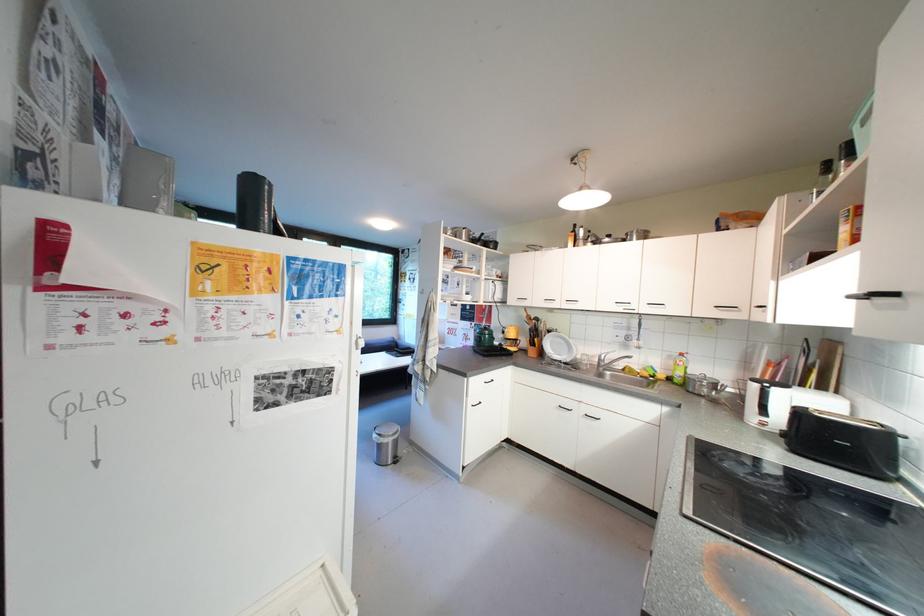
Where would you lift the white electric kettle? Please return your answer as a coordinate pair (x, y).

(763, 398)